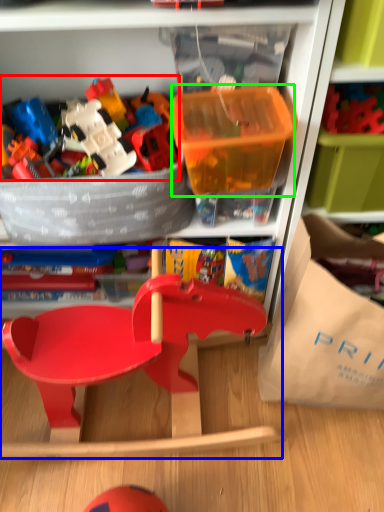
Question: Based on their relative distances, which object is nearer to toy (highlighted by a red box)? Choose from baby carriage (highlighted by a blue box) and storage box (highlighted by a green box).

Choices:
 (A) baby carriage
 (B) storage box

Answer: (B)